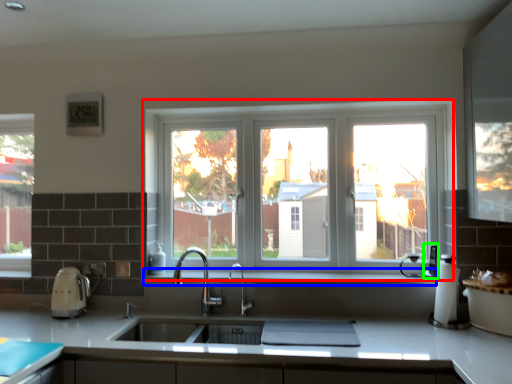
Question: Considering the real-world distances, which object is closest to window (highlighted by a red box)? window sill (highlighted by a blue box) or appliance (highlighted by a green box).

Choices:
 (A) window sill
 (B) appliance

Answer: (A)